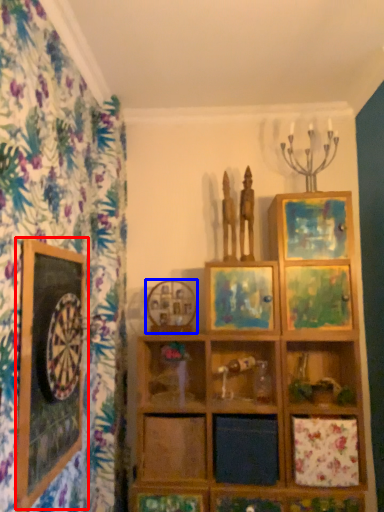
Question: Which object appears closest to the camera in this image, picture frame (highlighted by a red box) or picture frame (highlighted by a blue box)?

Choices:
 (A) picture frame
 (B) picture frame

Answer: (A)